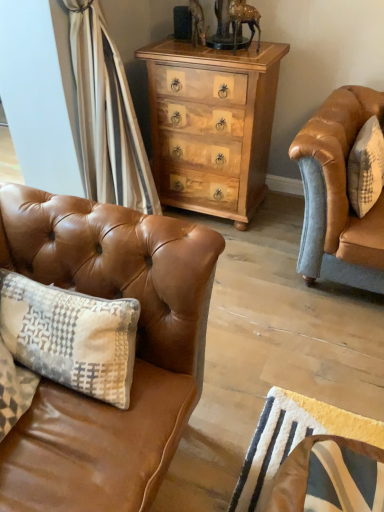
Question: Does leather swivel chair at lower right come in front of light brown wood chest of drawers at center?

Choices:
 (A) yes
 (B) no

Answer: (A)

Question: Would you say leather swivel chair at lower right is outside light brown wood chest of drawers at center?

Choices:
 (A) no
 (B) yes

Answer: (B)

Question: Considering the relative positions of leather swivel chair at lower right and light brown wood chest of drawers at center in the image provided, is leather swivel chair at lower right behind light brown wood chest of drawers at center?

Choices:
 (A) no
 (B) yes

Answer: (A)

Question: Is leather swivel chair at lower right shorter than light brown wood chest of drawers at center?

Choices:
 (A) yes
 (B) no

Answer: (A)

Question: Does leather swivel chair at lower right turn towards light brown wood chest of drawers at center?

Choices:
 (A) no
 (B) yes

Answer: (A)

Question: Considering the relative positions of leather swivel chair at lower right and light brown wood chest of drawers at center in the image provided, is leather swivel chair at lower right to the right of light brown wood chest of drawers at center from the viewer's perspective?

Choices:
 (A) yes
 (B) no

Answer: (A)

Question: From a real-world perspective, does light brown wood chest of drawers at center stand above saddle brown leather couch at left?

Choices:
 (A) no
 (B) yes

Answer: (A)

Question: Is light brown wood chest of drawers at center not close to saddle brown leather couch at left?

Choices:
 (A) no
 (B) yes

Answer: (B)

Question: Considering the relative sizes of light brown wood chest of drawers at center and saddle brown leather couch at left in the image provided, is light brown wood chest of drawers at center bigger than saddle brown leather couch at left?

Choices:
 (A) yes
 (B) no

Answer: (A)

Question: Is light brown wood chest of drawers at center outside saddle brown leather couch at left?

Choices:
 (A) yes
 (B) no

Answer: (A)

Question: Is light brown wood chest of drawers at center facing away from saddle brown leather couch at left?

Choices:
 (A) no
 (B) yes

Answer: (A)

Question: From a real-world perspective, is light brown wood chest of drawers at center located beneath saddle brown leather couch at left?

Choices:
 (A) no
 (B) yes

Answer: (B)

Question: Are saddle brown leather couch at left and leather swivel chair at lower right located far from each other?

Choices:
 (A) yes
 (B) no

Answer: (B)